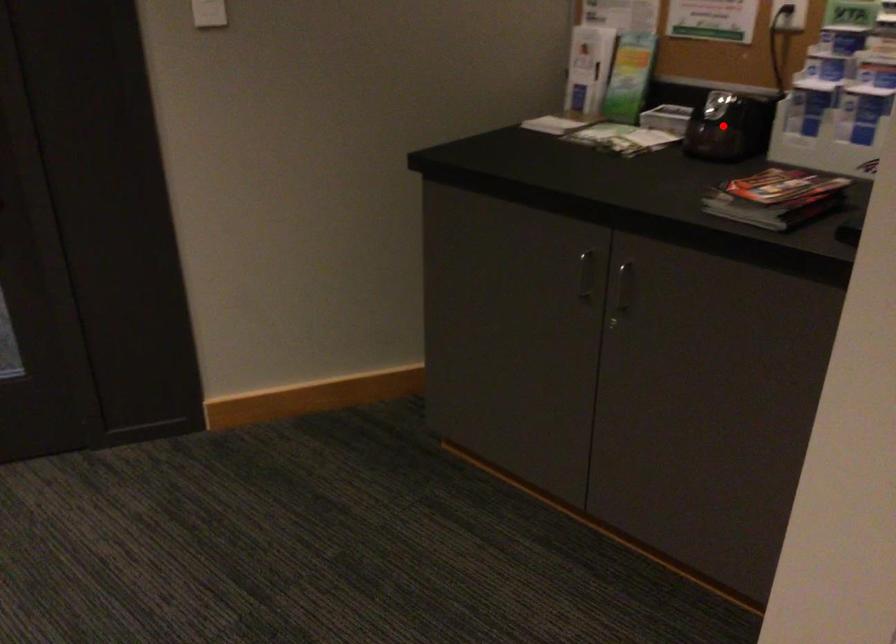
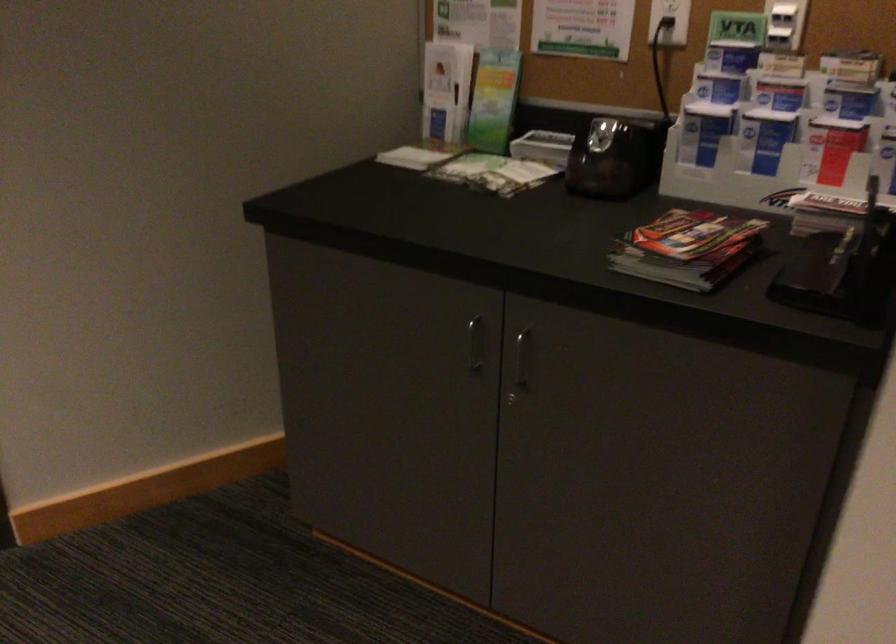
In the second image, find the point that corresponds to the highlighted location in the first image.

(613, 158)